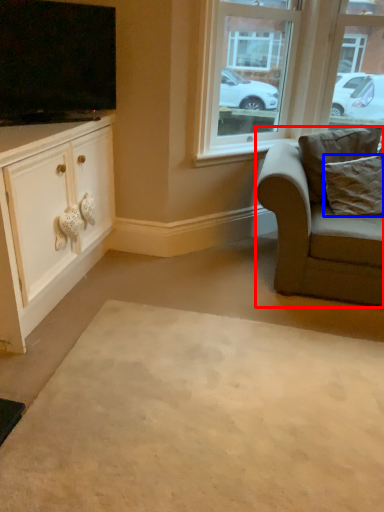
Question: Which object appears closest to the camera in this image, chair (highlighted by a red box) or pillow (highlighted by a blue box)?

Choices:
 (A) chair
 (B) pillow

Answer: (A)